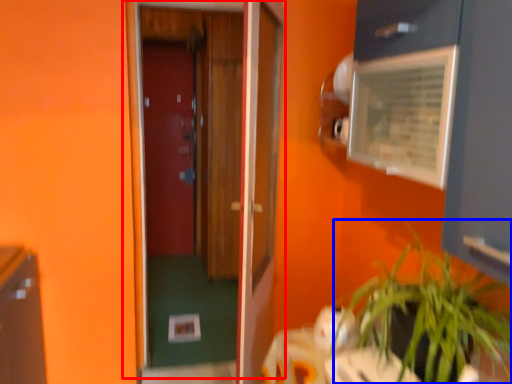
Question: Which of the following is the farthest to the observer, door (highlighted by a red box) or houseplant (highlighted by a blue box)?

Choices:
 (A) door
 (B) houseplant

Answer: (A)